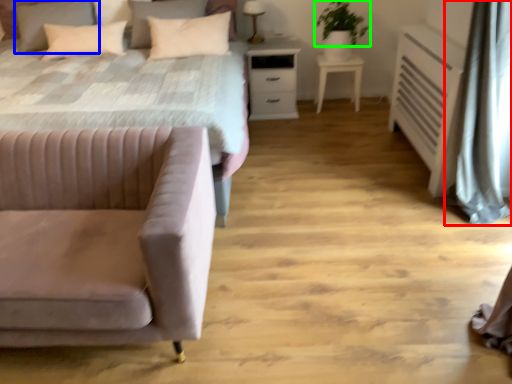
Question: Estimate the real-world distances between objects in this image. Which object is farther from curtain (highlighted by a red box), pillow (highlighted by a blue box) or plant (highlighted by a green box)?

Choices:
 (A) pillow
 (B) plant

Answer: (A)